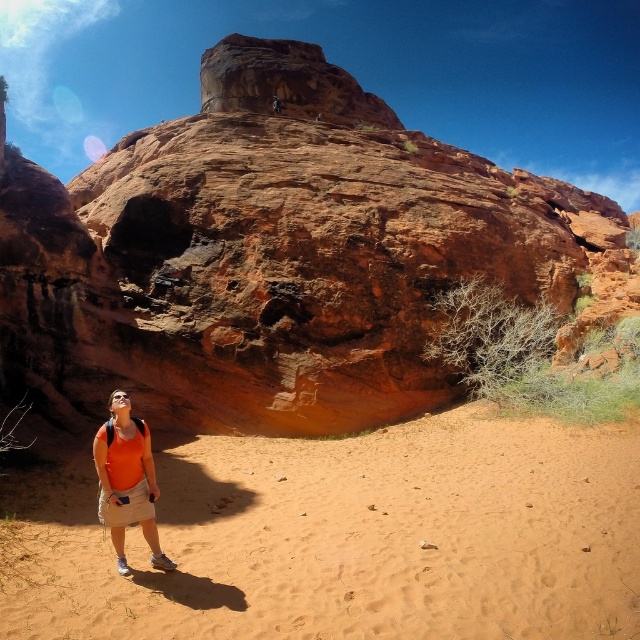
You are standing at the point labeled as point (356, 538) in the image. What type of terrain are you currently standing on?

The point (356, 538) is on sandy orange sand at lower center, so you are standing on sandy orange sand.

Consider the image. You are a photographer trying to capture the orange fabric shirt at lower left and the sandy orange sand at lower center in the same frame. Based on their sizes in the image, which object would appear larger in your photo?

The sandy orange sand at lower center would appear larger in the photo since it is bigger than the orange fabric shirt at lower left according to the description.

Looking at this image, you are a photographer planning to take a landscape photo of the large reddish brown rock formation. You want to ensure the orange fabric shirt at lower left and the sandy orange sand at lower center are both visible in the frame. Which object should you prioritize keeping closer to the center of the photo to avoid cropping?

The orange fabric shirt at lower left should be prioritized closer to the center of the photo because it is narrower than the sandy orange sand at lower center, making it more likely to be cropped out if positioned at the edge.